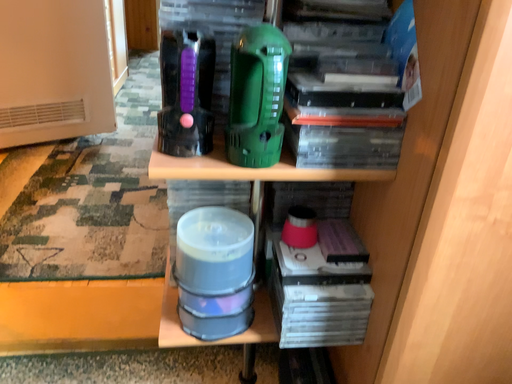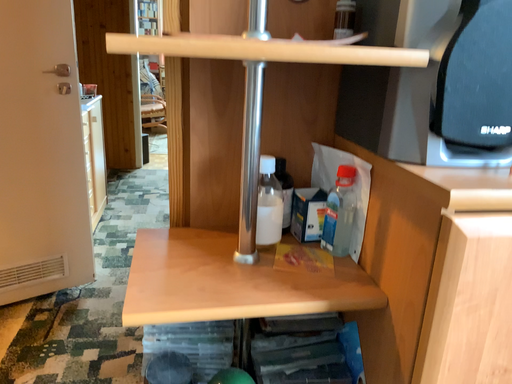
Question: How did the camera likely rotate when shooting the video?

Choices:
 (A) rotated upward
 (B) rotated downward

Answer: (A)